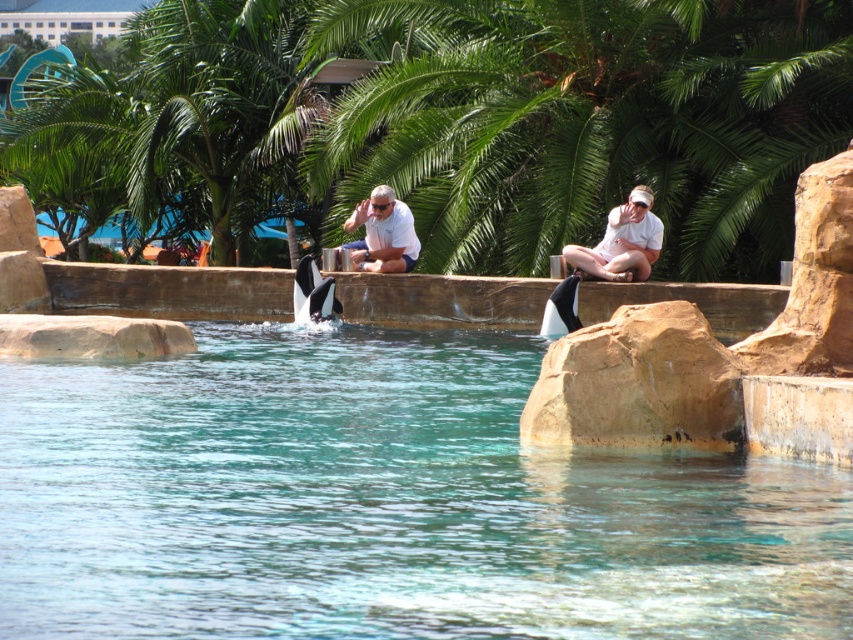
Who is more distant from viewer, (659, 342) or (625, 227)?

Point (625, 227)

Which is in front, point (636, 390) or point (630, 280)?

Point (636, 390) is more forward.

The image size is (853, 640). I want to click on brown rough rock at center, so click(637, 385).

Measure the distance between point [415,234] and camera.

Point [415,234] and camera are 38.50 meters apart from each other.

Can you confirm if white matte clothing at center is positioned above white matte shirt at center?

Actually, white matte clothing at center is below white matte shirt at center.

The image size is (853, 640). I want to click on white matte clothing at center, so click(x=622, y=241).

How distant is brown rough rock at center from white matte shirt at center?

brown rough rock at center and white matte shirt at center are 14.48 meters apart from each other.

Which of these two, brown rough rock at center or white matte shirt at center, stands shorter?

Standing shorter between the two is white matte shirt at center.

Describe the element at coordinates (637, 385) in the screenshot. I see `brown rough rock at center` at that location.

You are a GUI agent. You are given a task and a screenshot of the screen. Output one action in this format:
    pyautogui.click(x=<x>, y=<y>)
    Task: Click on the brown rough rock at center
    This screenshot has height=640, width=853.
    Given the screenshot: What is the action you would take?
    pyautogui.click(x=637, y=385)